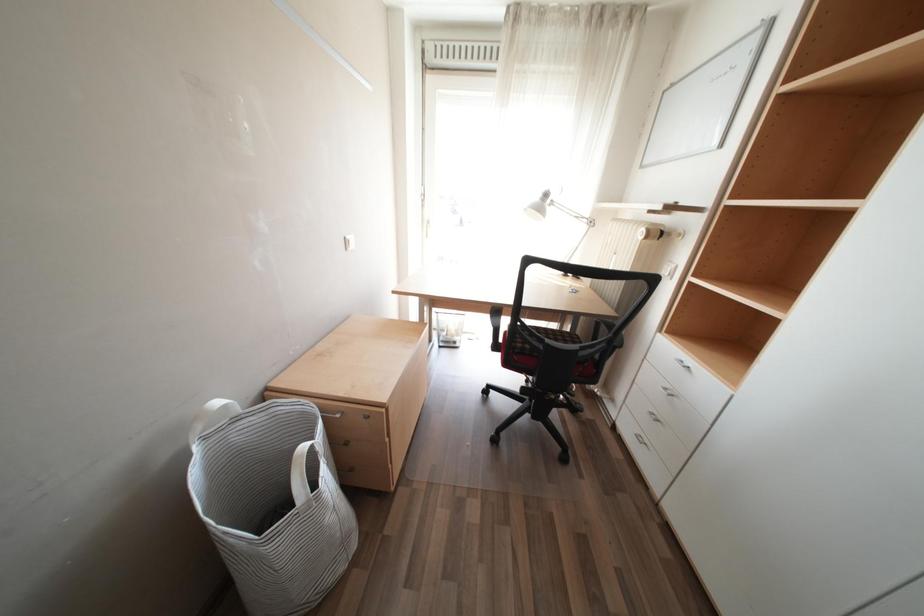
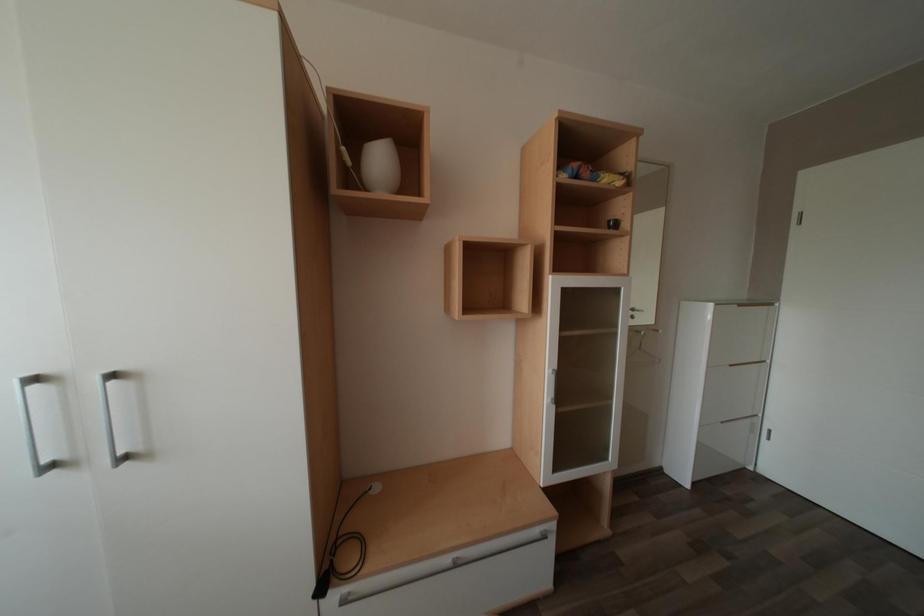
Based on the continuous images, in which direction is the camera rotating?

The camera's rotation is toward right-down.